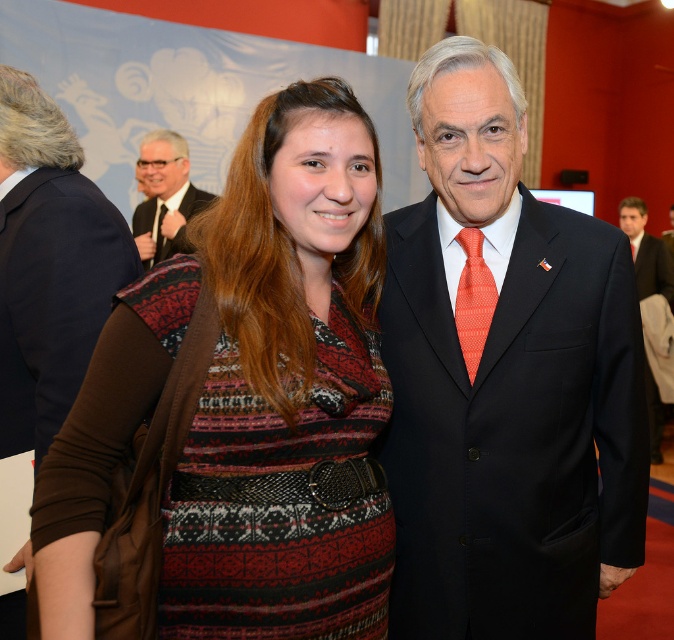
Does matte black suit at upper left have a greater width compared to orange textured tie at center?

Indeed, matte black suit at upper left has a greater width compared to orange textured tie at center.

Between matte black suit at upper left and orange textured tie at center, which one is positioned higher?

Positioned higher is matte black suit at upper left.

Which is in front, point (152, 154) or point (466, 340)?

Positioned in front is point (466, 340).

What are the coordinates of `matte black suit at upper left` in the screenshot? It's located at (164, 196).

Between dark blue suit at center and matte black tie at center, which one appears on the right side from the viewer's perspective?

dark blue suit at center

Who is higher up, dark blue suit at center or matte black tie at center?

Positioned higher is matte black tie at center.

Which is behind, point (652, 292) or point (162, 246)?

Point (652, 292)

Identify the location of dark blue suit at center. (652, 268).

Is point (429, 269) positioned before point (156, 184)?

Yes, it is.

What do you see at coordinates (506, 381) in the screenshot?
I see `black suit at center` at bounding box center [506, 381].

Describe the element at coordinates (506, 381) in the screenshot. I see `black suit at center` at that location.

Identify the location of black suit at center. The image size is (674, 640). (506, 381).